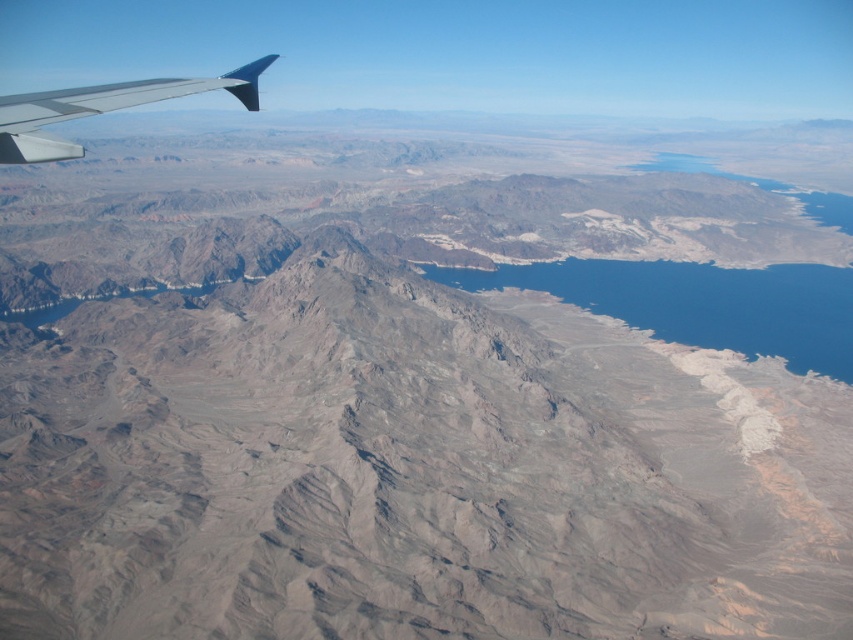
You are a pilot flying an airplane and you notice the blue water at center and the metallic gray wing at upper left in your view. How far apart are these two objects from each other?

The blue water at center is 367.65 meters away from the metallic gray wing at upper left.

You are a passenger on an airplane and notice the blue water at center and the metallic gray wing at upper left through the window. Which object is closer to you?

The metallic gray wing at upper left is behind the blue water at center, so the blue water at center is closer to you.

You are a pilot flying over a desert and see the point at coordinates (700, 304). What is the most likely object at that point?

The blue water at center is represented by point (700, 304), so the most likely object at that point is the blue water at center.